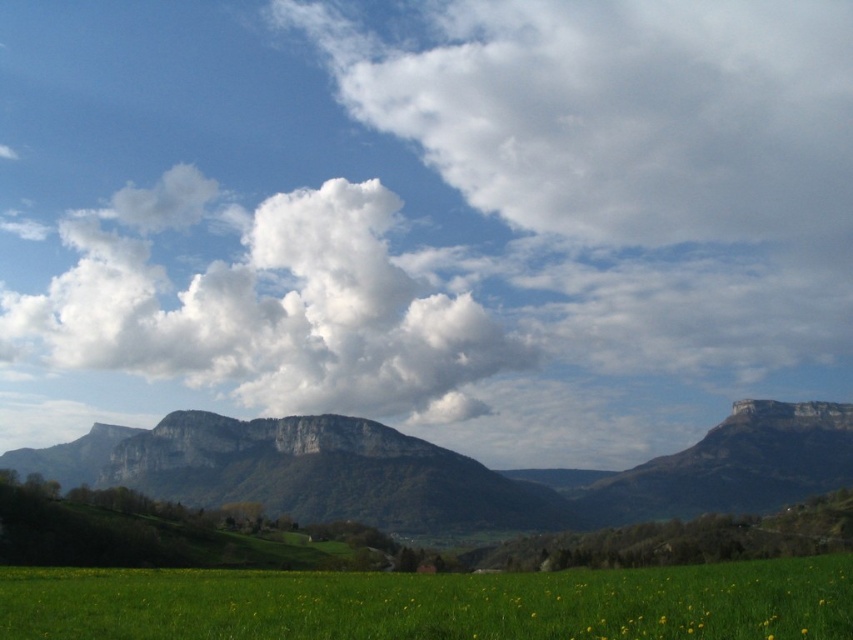
Question: Considering the relative positions of white fluffy cloud at upper center and white fluffy cloud at center in the image provided, where is white fluffy cloud at upper center located with respect to white fluffy cloud at center?

Choices:
 (A) left
 (B) right

Answer: (B)

Question: Which object is positioned farthest from the white fluffy cloud at upper center?

Choices:
 (A) white fluffy cloud at center
 (B) green grassy field at lower center

Answer: (B)

Question: Is white fluffy cloud at center in front of green grassy field at lower center?

Choices:
 (A) yes
 (B) no

Answer: (B)

Question: Is white fluffy cloud at upper center further to camera compared to white fluffy cloud at center?

Choices:
 (A) no
 (B) yes

Answer: (B)

Question: Which object is closer to the camera taking this photo?

Choices:
 (A) green grassy field at lower center
 (B) white fluffy cloud at upper center
 (C) white fluffy cloud at center

Answer: (A)

Question: Which point is closer to the camera?

Choices:
 (A) (740, 45)
 (B) (709, 614)

Answer: (B)